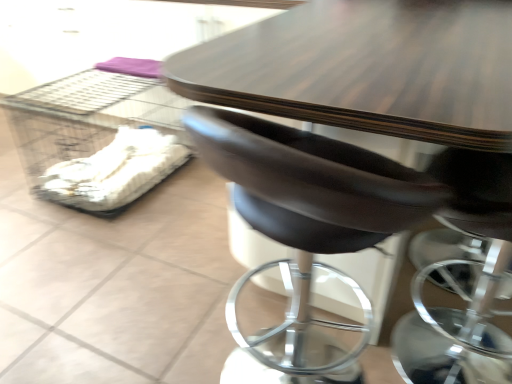
Question: From a real-world perspective, is clear plastic crate at left located beneath brown leather chair at center?

Choices:
 (A) no
 (B) yes

Answer: (B)

Question: Is clear plastic crate at left positioned before brown leather chair at center?

Choices:
 (A) no
 (B) yes

Answer: (A)

Question: From the image's perspective, is clear plastic crate at left over brown leather chair at center?

Choices:
 (A) yes
 (B) no

Answer: (A)

Question: From the image's perspective, does clear plastic crate at left appear lower than brown leather chair at center?

Choices:
 (A) yes
 (B) no

Answer: (B)

Question: Can you confirm if clear plastic crate at left is taller than brown leather chair at center?

Choices:
 (A) no
 (B) yes

Answer: (A)

Question: Can you confirm if clear plastic crate at left is shorter than brown leather chair at center?

Choices:
 (A) no
 (B) yes

Answer: (B)

Question: From a real-world perspective, does brown leather chair at center sit lower than clear plastic crate at left?

Choices:
 (A) no
 (B) yes

Answer: (A)

Question: Is brown leather chair at center looking in the opposite direction of clear plastic crate at left?

Choices:
 (A) no
 (B) yes

Answer: (A)

Question: Considering the relative positions of brown leather chair at center and clear plastic crate at left in the image provided, is brown leather chair at center behind clear plastic crate at left?

Choices:
 (A) yes
 (B) no

Answer: (B)

Question: Is brown leather chair at center shorter than clear plastic crate at left?

Choices:
 (A) no
 (B) yes

Answer: (A)

Question: Is brown leather chair at center smaller than clear plastic crate at left?

Choices:
 (A) yes
 (B) no

Answer: (B)

Question: Can you confirm if brown leather chair at center is positioned to the right of clear plastic crate at left?

Choices:
 (A) no
 (B) yes

Answer: (B)

Question: From the image's perspective, is clear plastic crate at left positioned above or below brown leather chair at center?

Choices:
 (A) below
 (B) above

Answer: (B)